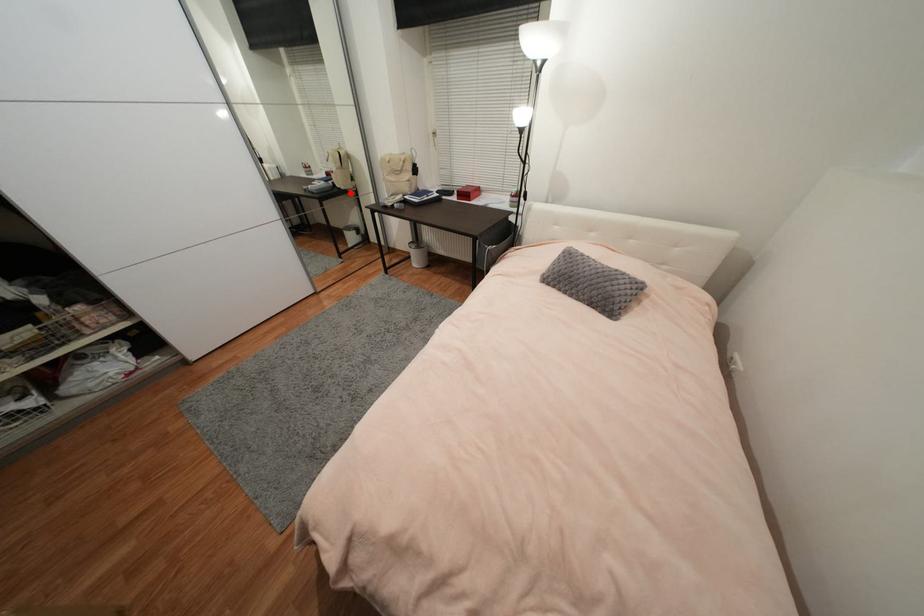
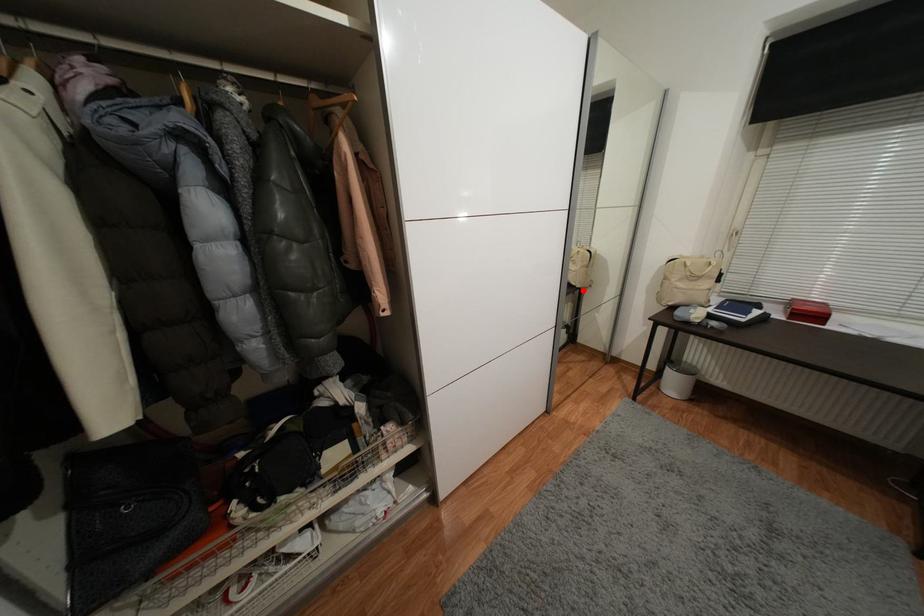
I am providing you with two images of the same scene from different viewpoints. A red point is marked on the first image and another point is marked on the second image. Is the marked point in image1 the same physical position as the marked point in image2?

Yes